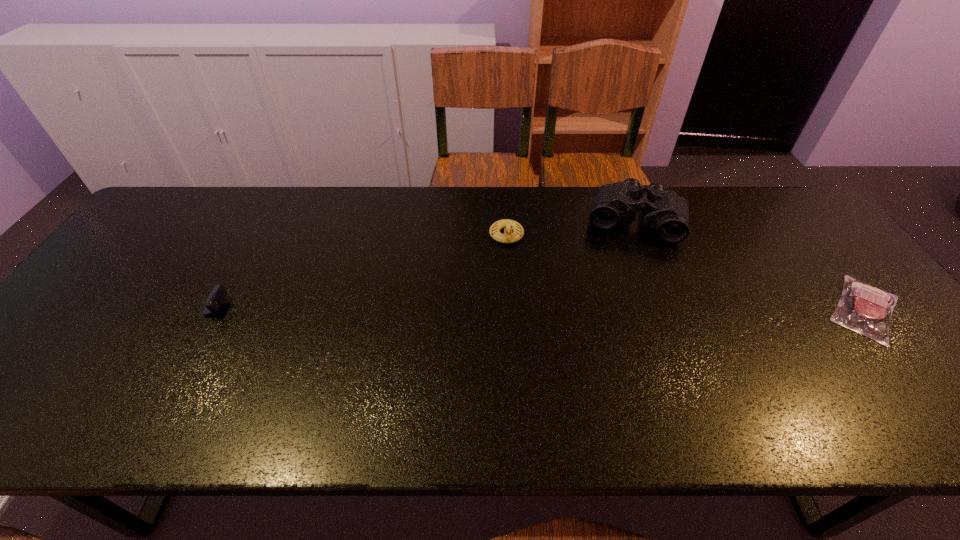
Where is `the leftmost object`? Image resolution: width=960 pixels, height=540 pixels. the leftmost object is located at coordinates (218, 294).

Where is `the third tallest object`? the third tallest object is located at coordinates (218, 294).

Where is `the shortest object`? This screenshot has width=960, height=540. the shortest object is located at coordinates (863, 308).

Find the location of `the rightmost object`. the rightmost object is located at coordinates (863, 308).

Where is `duckling`? The width and height of the screenshot is (960, 540). duckling is located at coordinates (508, 237).

Locate an element on the screen. the second object from left to right is located at coordinates (508, 237).

Identify the location of the tallest object. This screenshot has height=540, width=960. (665, 211).

This screenshot has height=540, width=960. In order to click on binoculars in this screenshot , I will do `click(665, 211)`.

Locate an element on the screen. The height and width of the screenshot is (540, 960). free space located on the front-facing side of the leftmost object is located at coordinates [244, 310].

I want to click on free space located 0.130m on the left of the steak, so click(x=770, y=309).